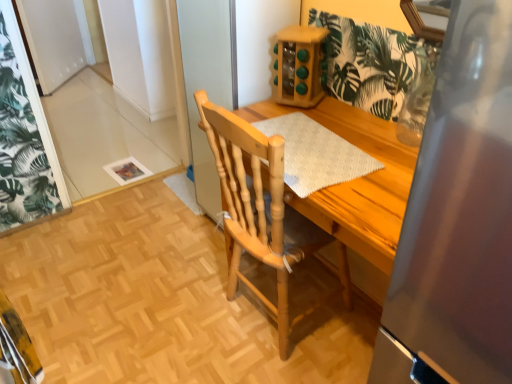
Find the location of a particular element. free space to the right of white textured placemat at center is located at coordinates [379, 145].